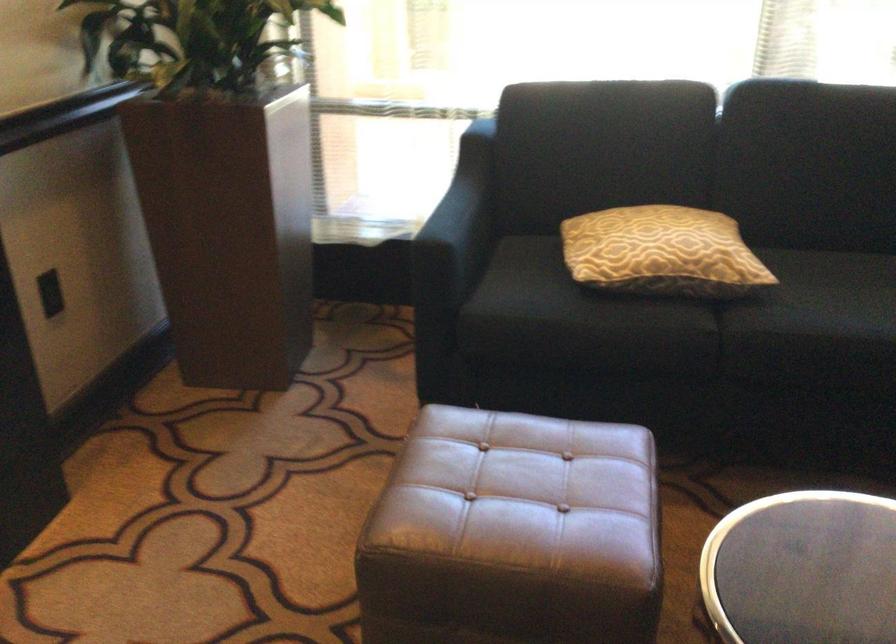
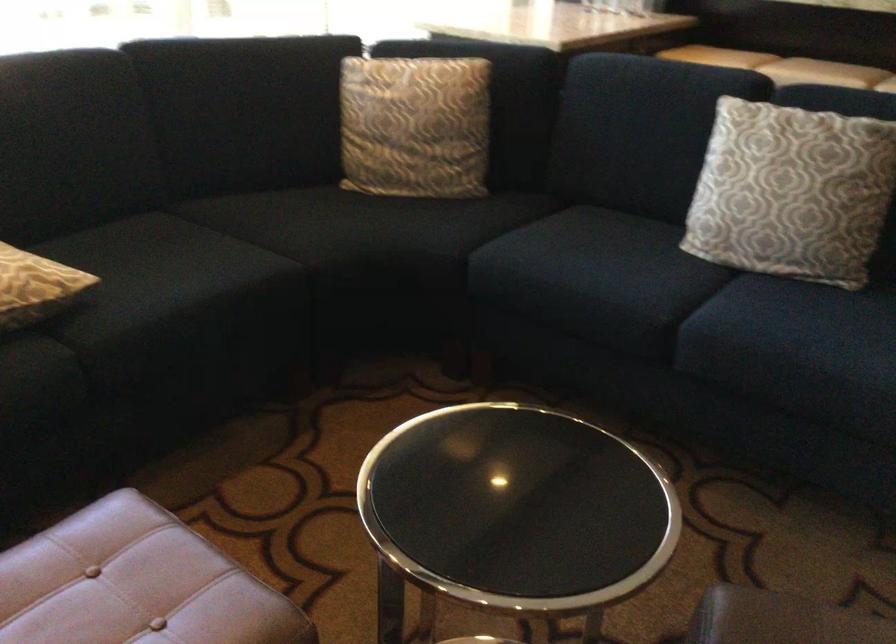
Question: The camera is either moving clockwise (left) or counter-clockwise (right) around the object. The first image is from the beginning of the video and the second image is from the end. Is the camera moving left or right when shooting the video?

Choices:
 (A) Left
 (B) Right

Answer: (A)